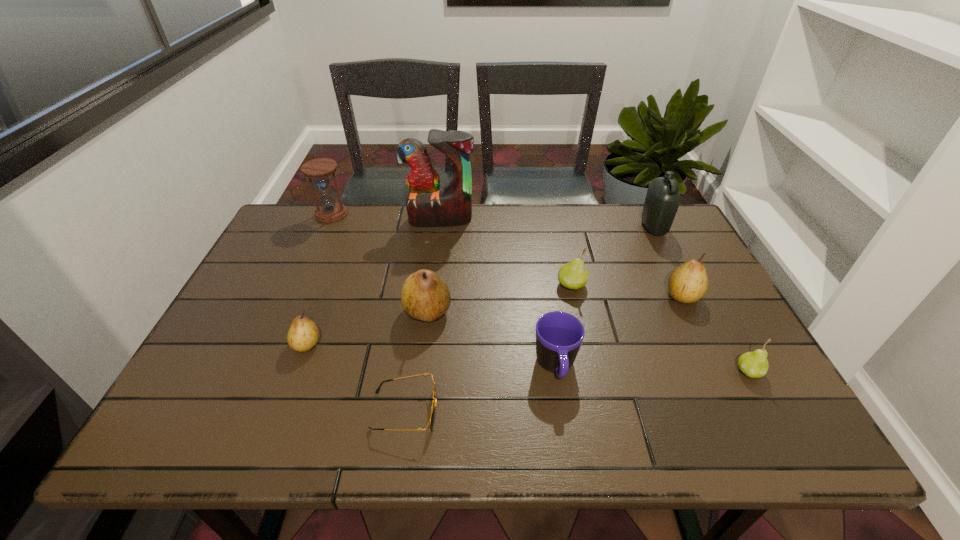
You are a GUI agent. You are given a task and a screenshot of the screen. Output one action in this format:
    pyautogui.click(x=<x>, y=<y>)
    Task: Click on the object that is at the far left corner
    Image resolution: width=960 pixels, height=540 pixels.
    Given the screenshot: What is the action you would take?
    coord(329,211)

In order to click on object positioned at the far right corner in this screenshot , I will do `click(662, 200)`.

You are a GUI agent. You are given a task and a screenshot of the screen. Output one action in this format:
    pyautogui.click(x=<x>, y=<y>)
    Task: Click on the vacant space at the far edge
    
    Given the screenshot: What is the action you would take?
    tap(565, 211)

Locate an element on the screen. The height and width of the screenshot is (540, 960). free spot at the near edge of the desktop is located at coordinates (384, 442).

The image size is (960, 540). Identify the location of free space at the left edge of the desktop. click(x=264, y=373).

Where is `vacant area at the right edge`? The width and height of the screenshot is (960, 540). vacant area at the right edge is located at coordinates (704, 298).

In the image, there is a desktop. Identify the location of free space at the near right corner. (756, 419).

Where is `unoccupied area between the right green pear and the mug`? This screenshot has height=540, width=960. unoccupied area between the right green pear and the mug is located at coordinates (653, 369).

I want to click on blank region between the tallest object and the hourglass, so click(x=386, y=217).

What are the coordinates of `unoccupied position between the black sunglasses and the bottle` in the screenshot? It's located at (529, 319).